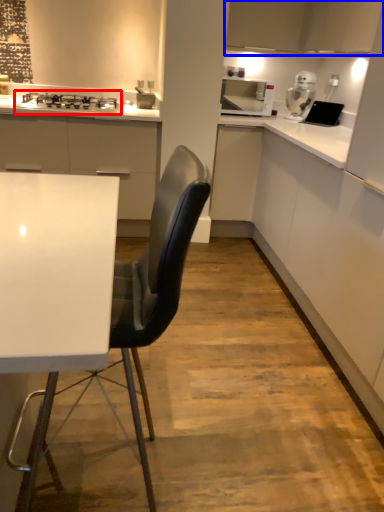
Question: Among these objects, which one is nearest to the camera, gas stove (highlighted by a red box) or cabinetry (highlighted by a blue box)?

Choices:
 (A) gas stove
 (B) cabinetry

Answer: (B)